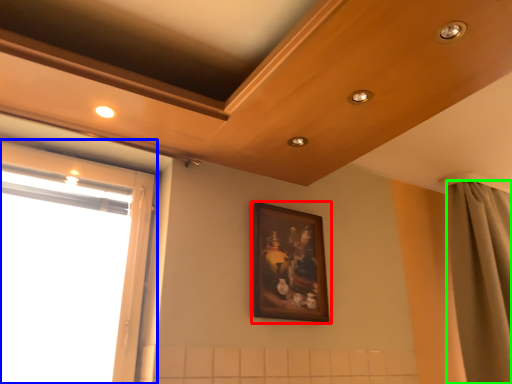
Question: Estimate the real-world distances between objects in this image. Which object is farther from picture frame (highlighted by a red box), window (highlighted by a blue box) or curtain (highlighted by a green box)?

Choices:
 (A) window
 (B) curtain

Answer: (B)